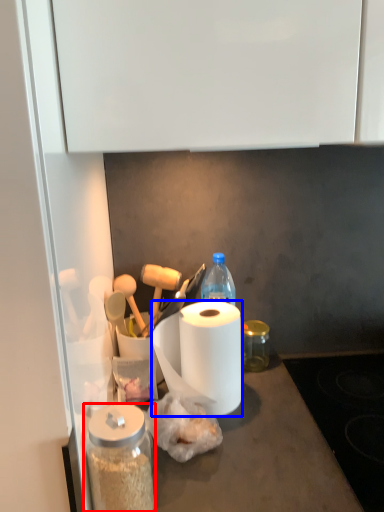
Question: Among these objects, which one is farthest to the camera, glass jar (highlighted by a red box) or paper towel (highlighted by a blue box)?

Choices:
 (A) glass jar
 (B) paper towel

Answer: (B)